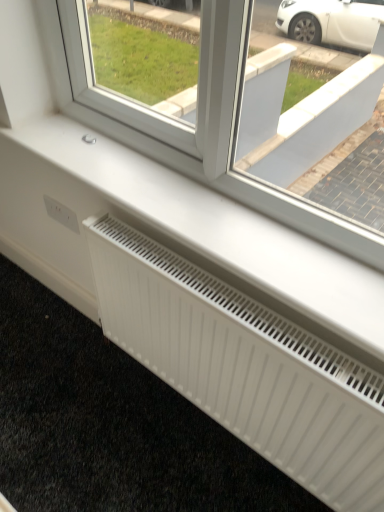
At what (x,y) coordinates should I click in order to perform the action: click on empty space that is ontop of white matte radiator at lower center (from a real-world perspective). Please return your answer as a coordinate pair (x, y). Looking at the image, I should click on (237, 306).